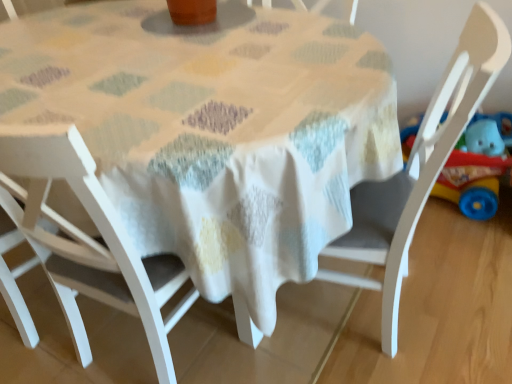
What do you see at coordinates (476, 172) in the screenshot?
I see `rubberized plastic toy car at right` at bounding box center [476, 172].

What do you see at coordinates (88, 240) in the screenshot? I see `white wood chair at center, which ranks as the second chair in left-to-right order` at bounding box center [88, 240].

What are the coordinates of `white wood chair at lower left, the first chair from the left` in the screenshot? It's located at (65, 298).

At what (x,y) coordinates should I click in order to perform the action: click on white wood chair at center, the 1th chair positioned from the right. Please return your answer as a coordinate pair (x, y). Looking at the image, I should click on (419, 169).

In order to face white fabric table at center, should I rotate leftwards or rightwards?

Result: A 11.268 degree turn to the left will do.

At what (x,y) coordinates should I click in order to perform the action: click on rubberized plastic toy car at right. Please return your answer as a coordinate pair (x, y). This screenshot has height=384, width=512. Looking at the image, I should click on (476, 172).

Is white fabric table at center far away from rubberized plastic toy car at right?

Answer: No, white fabric table at center is in close proximity to rubberized plastic toy car at right.

Which object is thinner, white fabric table at center or rubberized plastic toy car at right?

With smaller width is rubberized plastic toy car at right.

Could you tell me if white fabric table at center is facing rubberized plastic toy car at right?

No, white fabric table at center does not turn towards rubberized plastic toy car at right.

Does white fabric table at center have a greater height compared to rubberized plastic toy car at right?

Indeed, white fabric table at center has a greater height compared to rubberized plastic toy car at right.

From the image's perspective, between white wood chair at center, the 1th chair positioned from the right, and white wood chair at center, marked as the 2th chair in a right-to-left arrangement, who is located below?

white wood chair at center, marked as the 2th chair in a right-to-left arrangement.

From a real-world perspective, which is physically below, white wood chair at center, marked as the 3th chair in a left-to-right arrangement, or white wood chair at center, marked as the 2th chair in a right-to-left arrangement?

In real-world perspective, white wood chair at center, marked as the 3th chair in a left-to-right arrangement, is lower.

Does white wood chair at center, the 1th chair positioned from the right, come behind white wood chair at center, which ranks as the second chair in left-to-right order?

That is True.

Which object is thinner, white wood chair at center, the 1th chair positioned from the right, or white wood chair at center, which ranks as the second chair in left-to-right order?

Thinner between the two is white wood chair at center, which ranks as the second chair in left-to-right order.

From the image's perspective, would you say white fabric table at center is shown under white wood chair at center, marked as the 2th chair in a right-to-left arrangement?

No.

Is white fabric table at center wider or thinner than white wood chair at center, marked as the 2th chair in a right-to-left arrangement?

Considering their sizes, white fabric table at center looks broader than white wood chair at center, marked as the 2th chair in a right-to-left arrangement.

You are a GUI agent. You are given a task and a screenshot of the screen. Output one action in this format:
    pyautogui.click(x=<x>, y=<y>)
    Task: Click on the table on the right of white wood chair at center, marked as the 2th chair in a right-to-left arrangement
    This screenshot has width=512, height=384.
    Given the screenshot: What is the action you would take?
    pyautogui.click(x=214, y=129)

Which object is wider, white wood chair at center, which ranks as the second chair in left-to-right order, or white wood chair at center, marked as the 3th chair in a left-to-right arrangement?

white wood chair at center, marked as the 3th chair in a left-to-right arrangement.

Is white wood chair at center, which ranks as the second chair in left-to-right order, turned away from white wood chair at center, marked as the 3th chair in a left-to-right arrangement?

No, white wood chair at center, which ranks as the second chair in left-to-right order, is not facing away from white wood chair at center, marked as the 3th chair in a left-to-right arrangement.

Does white wood chair at center, which ranks as the second chair in left-to-right order, have a larger size compared to white wood chair at center, marked as the 3th chair in a left-to-right arrangement?

Actually, white wood chair at center, which ranks as the second chair in left-to-right order, might be smaller than white wood chair at center, marked as the 3th chair in a left-to-right arrangement.

From a real-world perspective, is white wood chair at center, which ranks as the second chair in left-to-right order, physically below white wood chair at center, marked as the 3th chair in a left-to-right arrangement?

Actually, white wood chair at center, which ranks as the second chair in left-to-right order, is physically above white wood chair at center, marked as the 3th chair in a left-to-right arrangement, in the real world.

Between white wood chair at center, marked as the 3th chair in a left-to-right arrangement, and white fabric table at center, which one has smaller width?

white wood chair at center, marked as the 3th chair in a left-to-right arrangement.

Is white wood chair at center, marked as the 3th chair in a left-to-right arrangement, facing away from white fabric table at center?

Yes, white wood chair at center, marked as the 3th chair in a left-to-right arrangement, is positioned with its back facing white fabric table at center.

Is white wood chair at lower left, the first chair from the left, touching white wood chair at center, marked as the 2th chair in a right-to-left arrangement?

No, white wood chair at lower left, the first chair from the left, is not beside white wood chair at center, marked as the 2th chair in a right-to-left arrangement.

Can you confirm if white wood chair at lower left, the first chair from the left, is positioned to the left of white wood chair at center, marked as the 2th chair in a right-to-left arrangement?

Indeed, white wood chair at lower left, the first chair from the left, is positioned on the left side of white wood chair at center, marked as the 2th chair in a right-to-left arrangement.

Considering their positions, is white wood chair at lower left, which appears as the 3th chair when viewed from the right, located in front of or behind white wood chair at center, marked as the 2th chair in a right-to-left arrangement?

white wood chair at lower left, which appears as the 3th chair when viewed from the right, is behind white wood chair at center, marked as the 2th chair in a right-to-left arrangement.

Is white wood chair at lower left, which appears as the 3th chair when viewed from the right, oriented towards white fabric table at center?

Yes, white wood chair at lower left, which appears as the 3th chair when viewed from the right, is turned towards white fabric table at center.

From the picture: Is white wood chair at lower left, which appears as the 3th chair when viewed from the right, next to white fabric table at center and touching it?

There is a gap between white wood chair at lower left, which appears as the 3th chair when viewed from the right, and white fabric table at center.

From a real-world perspective, which object rests below the other?

white fabric table at center, from a real-world perspective.

How different are the orientations of white wood chair at lower left, the first chair from the left, and white fabric table at center in degrees?

The facing directions of white wood chair at lower left, the first chair from the left, and white fabric table at center are 178 degrees apart.

Locate an element on the screen. toy on the right of white fabric table at center is located at coordinates (476, 172).

I want to click on the 1st chair to the left of the white wood chair at center, the 1th chair positioned from the right, counting from the anchor's position, so click(x=88, y=240).

When comparing their distances from white fabric table at center, does white wood chair at lower left, the first chair from the left, or white wood chair at center, marked as the 3th chair in a left-to-right arrangement, seem closer?

white wood chair at center, marked as the 3th chair in a left-to-right arrangement, is closer to white fabric table at center.

Which object lies nearer to the anchor point white wood chair at lower left, which appears as the 3th chair when viewed from the right, rubberized plastic toy car at right or white wood chair at center, the 1th chair positioned from the right?

The object closer to white wood chair at lower left, which appears as the 3th chair when viewed from the right, is white wood chair at center, the 1th chair positioned from the right.

Which object lies further to the anchor point white wood chair at center, marked as the 2th chair in a right-to-left arrangement, white fabric table at center or white wood chair at center, the 1th chair positioned from the right?

Among the two, white wood chair at center, the 1th chair positioned from the right, is located further to white wood chair at center, marked as the 2th chair in a right-to-left arrangement.

Estimate the real-world distances between objects in this image. Which object is closer to rubberized plastic toy car at right, white wood chair at center, which ranks as the second chair in left-to-right order, or white wood chair at center, marked as the 3th chair in a left-to-right arrangement?

Based on the image, white wood chair at center, marked as the 3th chair in a left-to-right arrangement, appears to be nearer to rubberized plastic toy car at right.

Which object lies further to the anchor point white wood chair at lower left, the first chair from the left, white wood chair at center, marked as the 2th chair in a right-to-left arrangement, or rubberized plastic toy car at right?

rubberized plastic toy car at right is further to white wood chair at lower left, the first chair from the left.

Looking at the image, which one is located further to white fabric table at center, rubberized plastic toy car at right or white wood chair at center, marked as the 3th chair in a left-to-right arrangement?

rubberized plastic toy car at right is further to white fabric table at center.

Which object lies further to the anchor point white wood chair at center, marked as the 3th chair in a left-to-right arrangement, white wood chair at lower left, the first chair from the left, or white wood chair at center, marked as the 2th chair in a right-to-left arrangement?

white wood chair at lower left, the first chair from the left, is positioned further to the anchor white wood chair at center, marked as the 3th chair in a left-to-right arrangement.

In the scene shown: From the image, which object appears to be farther from rubberized plastic toy car at right, white wood chair at center, marked as the 3th chair in a left-to-right arrangement, or white wood chair at center, marked as the 2th chair in a right-to-left arrangement?

white wood chair at center, marked as the 2th chair in a right-to-left arrangement, is further to rubberized plastic toy car at right.

At what (x,y) coordinates should I click in order to perform the action: click on chair situated between white wood chair at lower left, which appears as the 3th chair when viewed from the right, and white wood chair at center, the 1th chair positioned from the right, from left to right. Please return your answer as a coordinate pair (x, y). The width and height of the screenshot is (512, 384). Looking at the image, I should click on (88, 240).

Identify the location of table situated between white wood chair at lower left, which appears as the 3th chair when viewed from the right, and white wood chair at center, the 1th chair positioned from the right, from left to right. (214, 129).

Identify the location of chair between white wood chair at center, marked as the 2th chair in a right-to-left arrangement, and rubberized plastic toy car at right, in the horizontal direction. (419, 169).

I want to click on table situated between white wood chair at center, which ranks as the second chair in left-to-right order, and white wood chair at center, marked as the 3th chair in a left-to-right arrangement, from left to right, so click(214, 129).